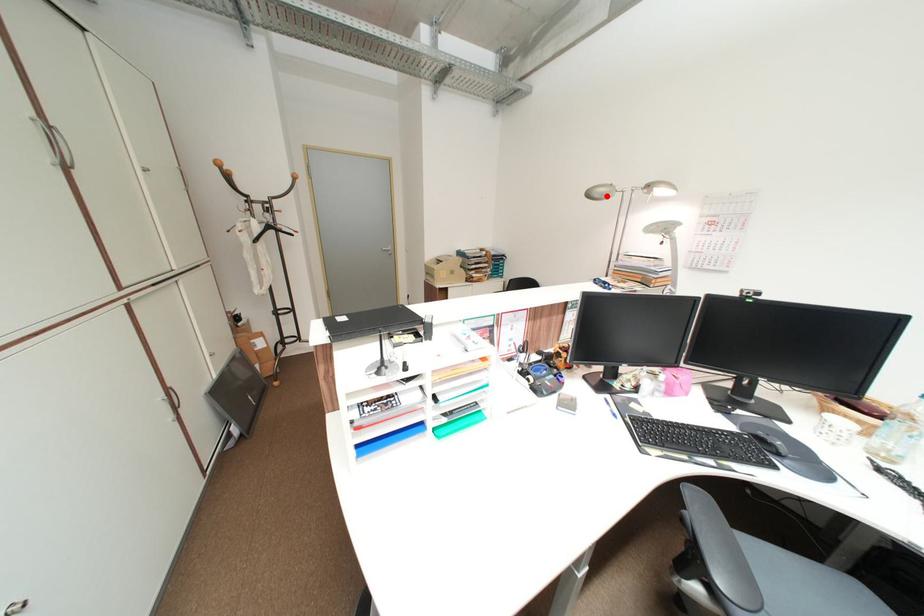
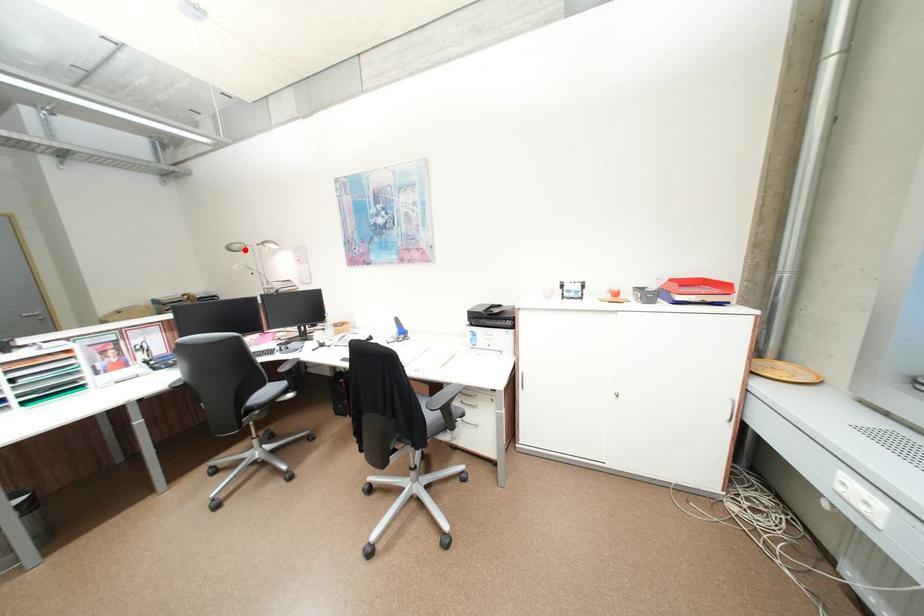
I am providing you with two images of the same scene from different viewpoints. A red point is marked on the first image and another point is marked on the second image. Does the point marked in image1 correspond to the same location as the one in image2?

Yes